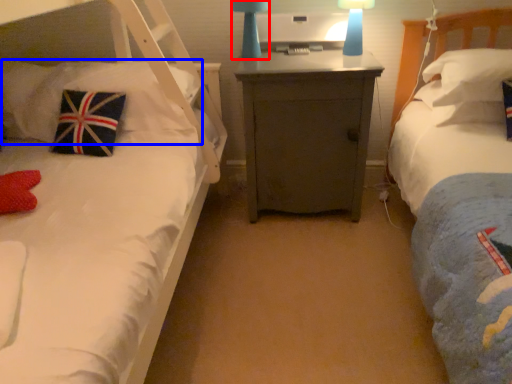
Question: Which point is further to the camera, bedside lamp (highlighted by a red box) or pillow (highlighted by a blue box)?

Choices:
 (A) bedside lamp
 (B) pillow

Answer: (A)